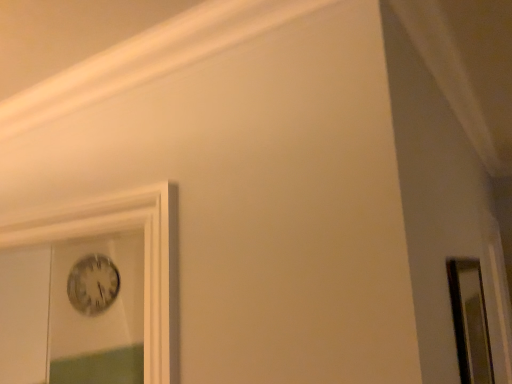
Question: From a real-world perspective, is clear glass mirror at right below metallic silver clock at upper left?

Choices:
 (A) yes
 (B) no

Answer: (A)

Question: Is clear glass mirror at right completely or partially outside of metallic silver clock at upper left?

Choices:
 (A) yes
 (B) no

Answer: (A)

Question: Is clear glass mirror at right oriented away from metallic silver clock at upper left?

Choices:
 (A) yes
 (B) no

Answer: (A)

Question: Can you confirm if clear glass mirror at right is smaller than metallic silver clock at upper left?

Choices:
 (A) yes
 (B) no

Answer: (B)

Question: Are clear glass mirror at right and metallic silver clock at upper left far apart?

Choices:
 (A) no
 (B) yes

Answer: (B)

Question: Does clear glass mirror at right have a larger size compared to metallic silver clock at upper left?

Choices:
 (A) yes
 (B) no

Answer: (A)

Question: Is the position of metallic silver clock at upper left less distant than that of clear glass mirror at right?

Choices:
 (A) yes
 (B) no

Answer: (B)

Question: Would you say metallic silver clock at upper left is a long distance from clear glass mirror at right?

Choices:
 (A) no
 (B) yes

Answer: (B)

Question: Considering the relative sizes of metallic silver clock at upper left and clear glass mirror at right in the image provided, is metallic silver clock at upper left taller than clear glass mirror at right?

Choices:
 (A) yes
 (B) no

Answer: (B)

Question: Is the depth of metallic silver clock at upper left greater than that of clear glass mirror at right?

Choices:
 (A) yes
 (B) no

Answer: (A)

Question: Can you confirm if metallic silver clock at upper left is shorter than clear glass mirror at right?

Choices:
 (A) no
 (B) yes

Answer: (B)

Question: Is metallic silver clock at upper left wider than clear glass mirror at right?

Choices:
 (A) no
 (B) yes

Answer: (A)

Question: From a real-world perspective, is clear glass mirror at right above or below metallic silver clock at upper left?

Choices:
 (A) below
 (B) above

Answer: (A)